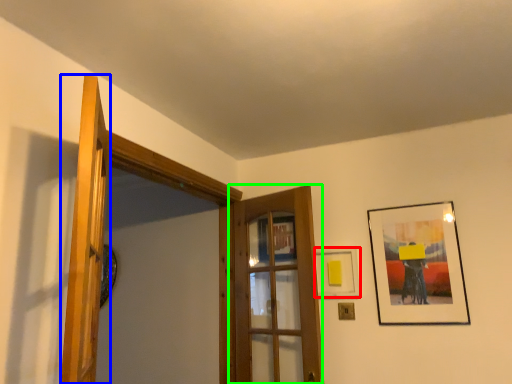
Question: Considering the real-world distances, which object is farthest from picture frame (highlighted by a red box)? door (highlighted by a blue box) or door (highlighted by a green box)?

Choices:
 (A) door
 (B) door

Answer: (A)